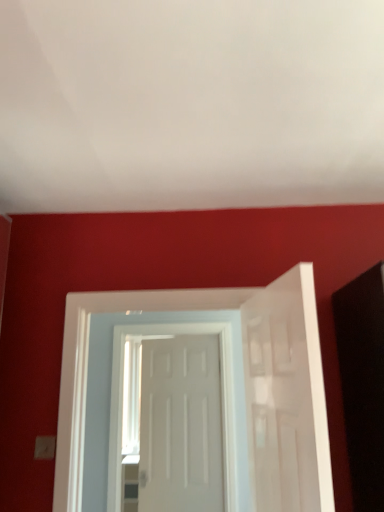
Question: From a real-world perspective, is white matte door at center, marked as the 3th door in a front-to-back arrangement, physically below white glossy door at center, acting as the 2th door starting from the back?

Choices:
 (A) yes
 (B) no

Answer: (A)

Question: From the image's perspective, does white matte door at center, the 1th door viewed from the back, appear lower than white glossy door at center, acting as the 2th door starting from the back?

Choices:
 (A) yes
 (B) no

Answer: (A)

Question: Is white matte door at center, the 1th door viewed from the back, aimed at white glossy door at center, which is counted as the 2th door, starting from the front?

Choices:
 (A) yes
 (B) no

Answer: (A)

Question: Is white matte door at center, marked as the 3th door in a front-to-back arrangement, not near white glossy door at center, acting as the 2th door starting from the back?

Choices:
 (A) no
 (B) yes

Answer: (A)

Question: Is white matte door at center, marked as the 3th door in a front-to-back arrangement, at the left side of white glossy door at center, which is counted as the 2th door, starting from the front?

Choices:
 (A) no
 (B) yes

Answer: (A)

Question: In terms of height, does white matte door at right, the 3th door when ordered from back to front, look taller or shorter compared to white glossy door at center, which is counted as the 2th door, starting from the front?

Choices:
 (A) tall
 (B) short

Answer: (B)

Question: In terms of size, does white matte door at right, the 3th door when ordered from back to front, appear bigger or smaller than white glossy door at center, which is counted as the 2th door, starting from the front?

Choices:
 (A) small
 (B) big

Answer: (A)

Question: Relative to white glossy door at center, acting as the 2th door starting from the back, is white matte door at right, the 3th door when ordered from back to front, in front or behind?

Choices:
 (A) front
 (B) behind

Answer: (A)

Question: Considering the relative positions of white matte door at right, marked as the first door in a front-to-back arrangement, and white glossy door at center, which is counted as the 2th door, starting from the front, in the image provided, is white matte door at right, marked as the first door in a front-to-back arrangement, to the left or to the right of white glossy door at center, which is counted as the 2th door, starting from the front,?

Choices:
 (A) left
 (B) right

Answer: (B)

Question: From the image's perspective, is white glossy door at center, which is counted as the 2th door, starting from the front, above or below white matte door at right, marked as the first door in a front-to-back arrangement?

Choices:
 (A) below
 (B) above

Answer: (A)

Question: In terms of size, does white glossy door at center, acting as the 2th door starting from the back, appear bigger or smaller than white matte door at right, marked as the first door in a front-to-back arrangement?

Choices:
 (A) big
 (B) small

Answer: (A)

Question: Based on their positions, is white glossy door at center, which is counted as the 2th door, starting from the front, located to the left or right of white matte door at right, marked as the first door in a front-to-back arrangement?

Choices:
 (A) right
 (B) left

Answer: (B)

Question: In the image, is white glossy door at center, acting as the 2th door starting from the back, positioned in front of or behind white matte door at right, the 3th door when ordered from back to front?

Choices:
 (A) front
 (B) behind

Answer: (B)

Question: Do you think white glossy door at center, acting as the 2th door starting from the back, is within white matte door at center, the 1th door viewed from the back, or outside of it?

Choices:
 (A) outside
 (B) inside

Answer: (A)

Question: Looking at their shapes, would you say white glossy door at center, which is counted as the 2th door, starting from the front, is wider or thinner than white matte door at center, the 1th door viewed from the back?

Choices:
 (A) thin
 (B) wide

Answer: (B)